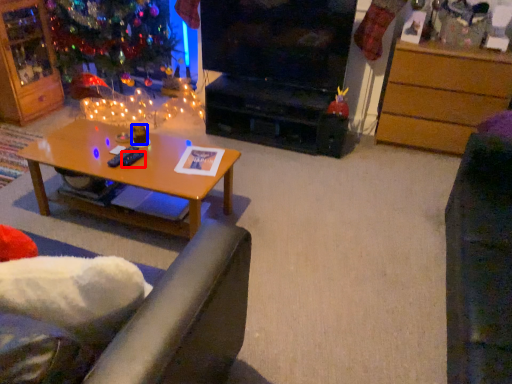
Question: Which point is further to the camera, remote control (highlighted by a red box) or coffee cup (highlighted by a blue box)?

Choices:
 (A) remote control
 (B) coffee cup

Answer: (B)